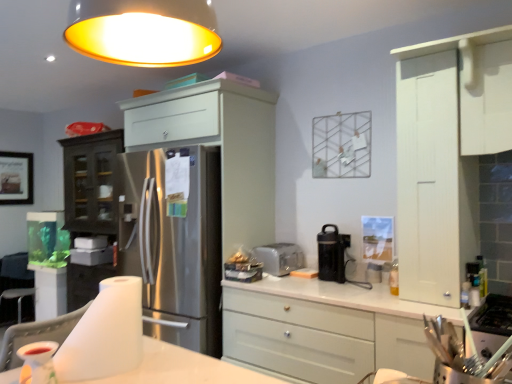
Locate an element on the screen. The height and width of the screenshot is (384, 512). white matte cabinet at center, which is counted as the 2th cabinetry, starting from the right is located at coordinates 326,329.

This screenshot has height=384, width=512. What do you see at coordinates (279, 258) in the screenshot?
I see `silver metallic toaster at center` at bounding box center [279, 258].

What do you see at coordinates (16, 178) in the screenshot?
I see `wooden framed picture at left` at bounding box center [16, 178].

Identify the location of translucent plastic cup at lower left. This screenshot has width=512, height=384. (38, 362).

From the image's perspective, is silver metallic toaster at center below white matte cabinet at upper right, marked as the first cabinetry in a right-to-left arrangement?

Indeed, from the image's perspective, silver metallic toaster at center is shown beneath white matte cabinet at upper right, marked as the first cabinetry in a right-to-left arrangement.

Consider the image. Can you confirm if silver metallic toaster at center is shorter than white matte cabinet at upper right, marked as the first cabinetry in a right-to-left arrangement?

Correct, silver metallic toaster at center is not as tall as white matte cabinet at upper right, marked as the first cabinetry in a right-to-left arrangement.

From a real-world perspective, between silver metallic toaster at center and white matte cabinet at upper right, placed as the third cabinetry when sorted from left to right, who is vertically lower?

From a 3D spatial view, silver metallic toaster at center is below.

Looking at this image, which object is more forward, silver metallic toaster at center or white matte cabinet at upper right, marked as the first cabinetry in a right-to-left arrangement?

white matte cabinet at upper right, marked as the first cabinetry in a right-to-left arrangement, is more forward.

Can you see white matte cabinet at center, arranged as the 2th cabinetry when viewed from the left, touching translucent plastic cup at lower left?

white matte cabinet at center, arranged as the 2th cabinetry when viewed from the left, and translucent plastic cup at lower left are not in contact.

Is point (320, 368) closer or farther from the camera than point (49, 366)?

Point (320, 368).

Considering the relative positions of white matte cabinet at center, which is counted as the 2th cabinetry, starting from the right, and translucent plastic cup at lower left in the image provided, is white matte cabinet at center, which is counted as the 2th cabinetry, starting from the right, to the right of translucent plastic cup at lower left from the viewer's perspective?

Indeed, white matte cabinet at center, which is counted as the 2th cabinetry, starting from the right, is positioned on the right side of translucent plastic cup at lower left.

Looking at this image, is white matte cabinet at center, which is counted as the 2th cabinetry, starting from the right, located outside translucent plastic cup at lower left?

white matte cabinet at center, which is counted as the 2th cabinetry, starting from the right, lies outside translucent plastic cup at lower left's area.

Is white matte cabinet at center, which is counted as the 2th cabinetry, starting from the right, completely or partially inside satin white cabinet at center, which ranks as the 1th cabinetry in left-to-right order?

Definitely not — white matte cabinet at center, which is counted as the 2th cabinetry, starting from the right, is not inside satin white cabinet at center, which ranks as the 1th cabinetry in left-to-right order.

Could you tell me if satin white cabinet at center, placed as the 3th cabinetry when sorted from right to left, is facing white matte cabinet at center, arranged as the 2th cabinetry when viewed from the left?

No.

Considering the points (253, 215) and (281, 343), which point is in front, point (253, 215) or point (281, 343)?

The point (281, 343) is closer to the camera.

In the scene shown: Is satin white cabinet at center, which ranks as the 1th cabinetry in left-to-right order, closer to the viewer compared to white matte cabinet at center, which is counted as the 2th cabinetry, starting from the right?

No, satin white cabinet at center, which ranks as the 1th cabinetry in left-to-right order, is further to the viewer.

Who is shorter, silver metallic toaster at center or translucent plastic cup at lower left?

translucent plastic cup at lower left.

From the image's perspective, would you say silver metallic toaster at center is positioned over translucent plastic cup at lower left?

Yes, from the image's perspective, silver metallic toaster at center is on top of translucent plastic cup at lower left.

Is silver metallic toaster at center at the left side of translucent plastic cup at lower left?

In fact, silver metallic toaster at center is to the right of translucent plastic cup at lower left.

Which is closer to the camera, (256,251) or (22,357)?

Point (256,251).

From the image's perspective, is black plastic coffee machine at right above or below translucent plastic cup at lower left?

black plastic coffee machine at right is above translucent plastic cup at lower left.

Is black plastic coffee machine at right positioned behind translucent plastic cup at lower left?

Yes, it is.

The width and height of the screenshot is (512, 384). I want to click on appliance that is on the left side of black plastic coffee machine at right, so click(38, 362).

Does translucent plastic cup at lower left have a larger size compared to white matte cabinet at upper right, marked as the first cabinetry in a right-to-left arrangement?

Incorrect, translucent plastic cup at lower left is not larger than white matte cabinet at upper right, marked as the first cabinetry in a right-to-left arrangement.

Could you measure the distance between translucent plastic cup at lower left and white matte cabinet at upper right, placed as the third cabinetry when sorted from left to right?

They are 5.90 feet apart.

Is translucent plastic cup at lower left positioned beyond the bounds of white matte cabinet at upper right, placed as the third cabinetry when sorted from left to right?

Yes, translucent plastic cup at lower left is outside of white matte cabinet at upper right, placed as the third cabinetry when sorted from left to right.

Looking at the image, does white fabric chair at lower left seem bigger or smaller compared to black plastic coffee machine at right?

white fabric chair at lower left is bigger than black plastic coffee machine at right.

Does white fabric chair at lower left have a greater width compared to black plastic coffee machine at right?

Correct, the width of white fabric chair at lower left exceeds that of black plastic coffee machine at right.

Is white fabric chair at lower left not inside black plastic coffee machine at right?

That's correct, white fabric chair at lower left is outside of black plastic coffee machine at right.

This screenshot has height=384, width=512. Find the location of `the 2nd cabinetry located above the silver metallic toaster at center (from a real-world perspective)`. the 2nd cabinetry located above the silver metallic toaster at center (from a real-world perspective) is located at coordinates (447, 154).

Where is `appliance above the white matte cabinet at center, arranged as the 2th cabinetry when viewed from the left (from the image's perspective)`? appliance above the white matte cabinet at center, arranged as the 2th cabinetry when viewed from the left (from the image's perspective) is located at coordinates (38, 362).

Considering their positions, is silver metallic toaster at center positioned closer to white matte cabinet at upper right, marked as the first cabinetry in a right-to-left arrangement, than translucent plastic cup at lower left?

Based on the image, silver metallic toaster at center appears to be nearer to white matte cabinet at upper right, marked as the first cabinetry in a right-to-left arrangement.

Considering their positions, is white matte cabinet at center, which is counted as the 2th cabinetry, starting from the right, positioned closer to silver metallic toaster at center than satin white cabinet at center, which ranks as the 1th cabinetry in left-to-right order?

white matte cabinet at center, which is counted as the 2th cabinetry, starting from the right, is positioned closer to the anchor silver metallic toaster at center.

From the image, which object appears to be farther from white matte cabinet at upper right, placed as the third cabinetry when sorted from left to right, wooden framed picture at left or satin white cabinet at center, which ranks as the 1th cabinetry in left-to-right order?

Based on the image, wooden framed picture at left appears to be further to white matte cabinet at upper right, placed as the third cabinetry when sorted from left to right.

Estimate the real-world distances between objects in this image. Which object is closer to white matte cabinet at center, arranged as the 2th cabinetry when viewed from the left, wooden framed picture at left or white matte cabinet at upper right, marked as the first cabinetry in a right-to-left arrangement?

The object closer to white matte cabinet at center, arranged as the 2th cabinetry when viewed from the left, is white matte cabinet at upper right, marked as the first cabinetry in a right-to-left arrangement.

Based on their spatial positions, is white glossy table at lower center or silver metallic toaster at center closer to white fabric chair at lower left?

white glossy table at lower center is positioned closer to the anchor white fabric chair at lower left.

Considering their positions, is white matte cabinet at upper right, placed as the third cabinetry when sorted from left to right, positioned closer to white matte cabinet at center, arranged as the 2th cabinetry when viewed from the left, than black plastic coffee machine at right?

Based on the image, black plastic coffee machine at right appears to be nearer to white matte cabinet at center, arranged as the 2th cabinetry when viewed from the left.

When comparing their distances from white matte cabinet at upper right, marked as the first cabinetry in a right-to-left arrangement, does satin white cabinet at center, which ranks as the 1th cabinetry in left-to-right order, or white glossy table at lower center seem further?

satin white cabinet at center, which ranks as the 1th cabinetry in left-to-right order.

From the image, which object appears to be nearer to silver metallic toaster at center, white matte cabinet at center, arranged as the 2th cabinetry when viewed from the left, or translucent plastic cup at lower left?

Based on the image, white matte cabinet at center, arranged as the 2th cabinetry when viewed from the left, appears to be nearer to silver metallic toaster at center.

I want to click on toaster between white matte cabinet at upper right, marked as the first cabinetry in a right-to-left arrangement, and white matte cabinet at center, which is counted as the 2th cabinetry, starting from the right, in the vertical direction, so click(279, 258).

Locate an element on the screen. This screenshot has height=384, width=512. toaster between white fabric chair at lower left and wooden framed picture at left from front to back is located at coordinates (279, 258).

Where is `coffee machine between white glossy table at lower center and wooden framed picture at left from front to back`? The width and height of the screenshot is (512, 384). coffee machine between white glossy table at lower center and wooden framed picture at left from front to back is located at coordinates (332, 254).

You are a GUI agent. You are given a task and a screenshot of the screen. Output one action in this format:
    pyautogui.click(x=<x>, y=<y>)
    Task: Click on the cabinetry situated between white fabric chair at lower left and white matte cabinet at center, which is counted as the 2th cabinetry, starting from the right, from left to right
    
    Given the screenshot: What is the action you would take?
    pyautogui.click(x=193, y=200)